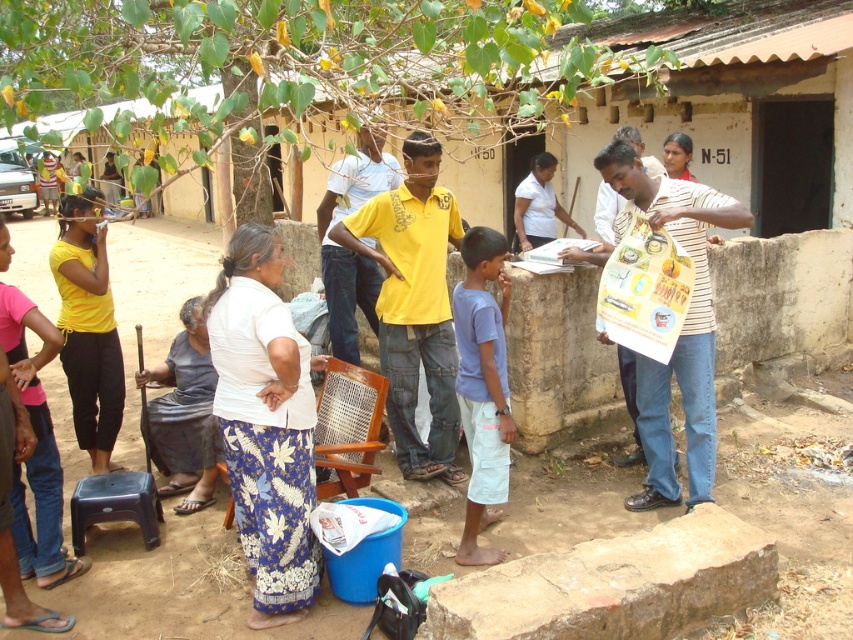
You are organizing a picnic and have a white woven fabric at center and a matte yellow shirt at left. Which item is wider?

The white woven fabric at center is wider than the matte yellow shirt at left.

You are standing at the center of the image and want to place a small potted plant exactly where the white woven fabric at center is located. What coordinates should you use?

The coordinates for the white woven fabric at center are at point (265, 424). Place the potted plant at those coordinates.

Based on the scene description, what object is located at the coordinates point (265, 424)?

The white woven fabric at center is located at point (265, 424).